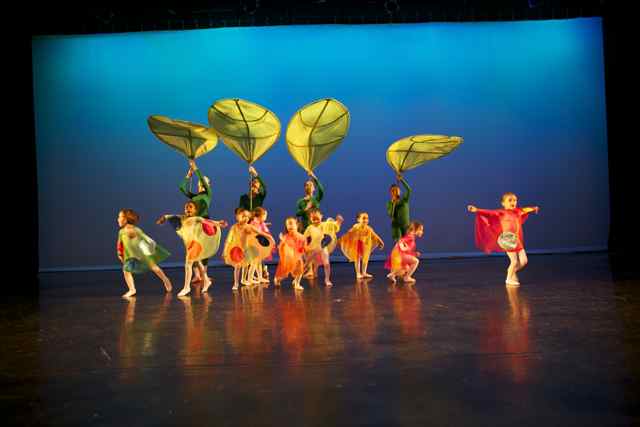
Identify the location of stage. Image resolution: width=640 pixels, height=427 pixels. (396, 385).